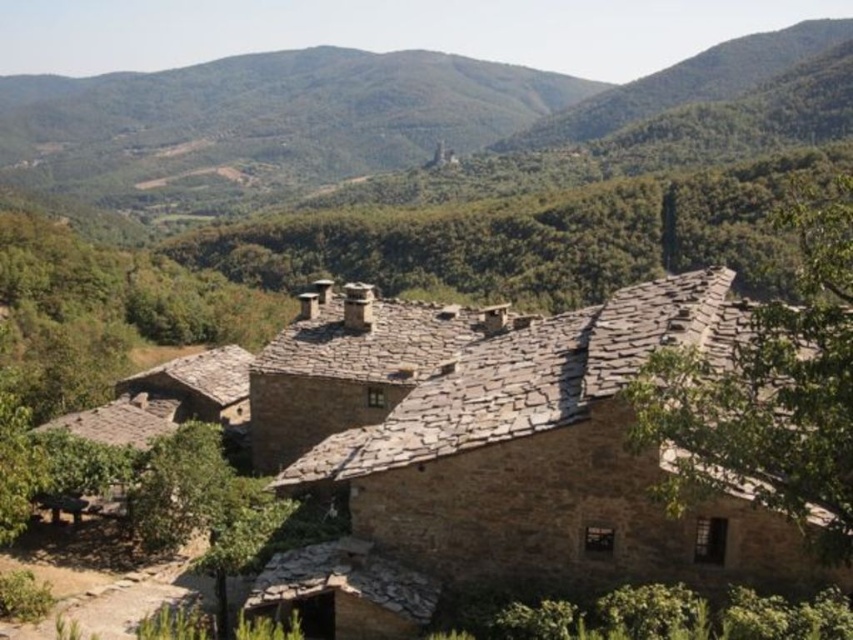
From the picture: Does green leafy forest at upper center have a greater height compared to green leafy tree at upper right?

Yes.

Who is positioned more to the right, green leafy forest at upper center or green leafy tree at upper right?

green leafy tree at upper right is more to the right.

Between point (3, 157) and point (662, 424), which one is positioned in front?

Positioned in front is point (662, 424).

Where is `green leafy forest at upper center`? This screenshot has width=853, height=640. green leafy forest at upper center is located at coordinates (335, 115).

Does green leafy forest at upper center have a lesser width compared to green leafy tree at lower left?

Incorrect, green leafy forest at upper center's width is not less than green leafy tree at lower left's.

Between green leafy forest at upper center and green leafy tree at lower left, which one appears on the right side from the viewer's perspective?

Positioned to the right is green leafy tree at lower left.

Who is more forward, (209,104) or (218,522)?

Positioned in front is point (218,522).

The width and height of the screenshot is (853, 640). I want to click on green leafy forest at upper center, so click(335, 115).

Is green leafy tree at upper right shorter than green leafy tree at lower left?

In fact, green leafy tree at upper right may be taller than green leafy tree at lower left.

Is point (722, 410) closer to viewer compared to point (219, 616)?

Yes, point (722, 410) is in front of point (219, 616).

The height and width of the screenshot is (640, 853). What do you see at coordinates (769, 392) in the screenshot?
I see `green leafy tree at upper right` at bounding box center [769, 392].

Where is `green leafy tree at upper right`? green leafy tree at upper right is located at coordinates (769, 392).